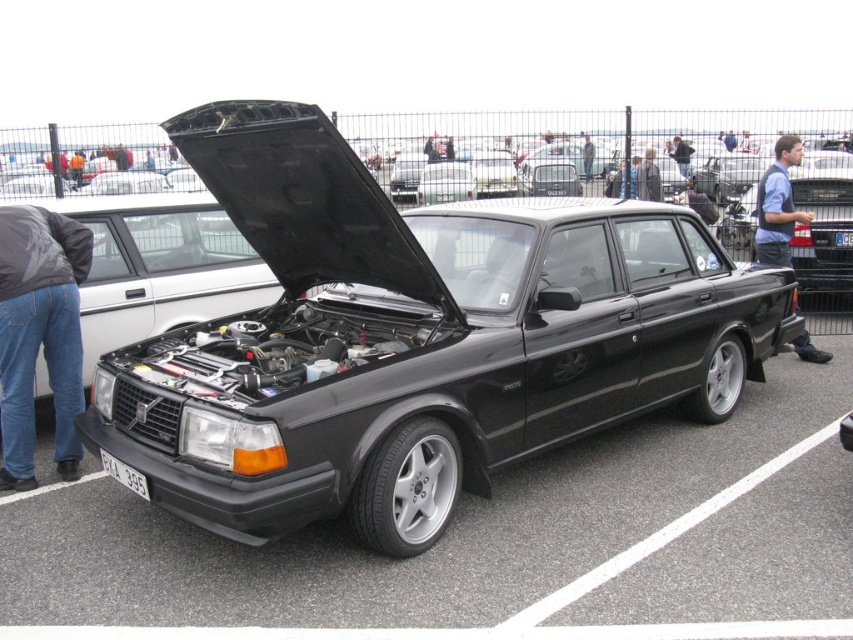
Question: Among these objects, which one is farthest from the camera?

Choices:
 (A) white plastic license plate at center
 (B) denim jeans at lower left
 (C) white plastic license plate at lower center
 (D) denim vest at right

Answer: (A)

Question: Is denim jeans at lower left bigger than white plastic license plate at center?

Choices:
 (A) no
 (B) yes

Answer: (B)

Question: Is denim jeans at lower left to the left of white plastic license plate at lower center from the viewer's perspective?

Choices:
 (A) yes
 (B) no

Answer: (A)

Question: Can you confirm if denim vest at right is positioned to the right of white plastic license plate at center?

Choices:
 (A) no
 (B) yes

Answer: (A)

Question: Estimate the real-world distances between objects in this image. Which object is closer to the denim vest at right?

Choices:
 (A) white plastic license plate at lower center
 (B) denim jeans at lower left

Answer: (A)

Question: Which of the following is the closest to the observer?

Choices:
 (A) white plastic license plate at lower center
 (B) denim jeans at lower left
 (C) white plastic license plate at center
 (D) denim vest at right

Answer: (A)